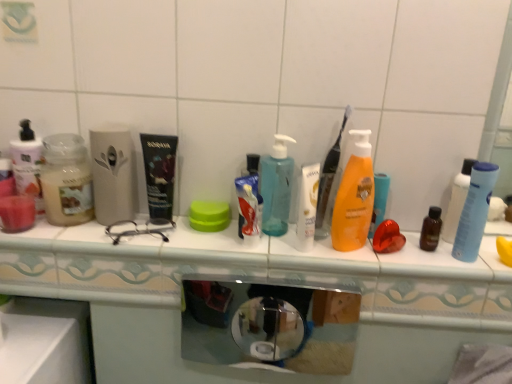
Question: Choose the correct answer: Is white glossy toothpaste at center inside translucent plastic pump bottle at center, the 2th bottle viewed from the left, or outside it?

Choices:
 (A) inside
 (B) outside

Answer: (B)

Question: Is white glossy toothpaste at center wider or thinner than translucent plastic pump bottle at center, the 2th bottle viewed from the left?

Choices:
 (A) thin
 (B) wide

Answer: (A)

Question: Which of these objects is positioned closest to the translucent plastic pump bottle at center, the 2th bottle viewed from the left?

Choices:
 (A) white glossy lotion at center
 (B) green plastic lid at center
 (C) blue matte bottle at right
 (D) white glossy toothpaste at center
 (E) orange matte lotion at center, the 1th bottle when ordered from right to left

Answer: (D)

Question: Which object is the farthest from the green plastic lid at center?

Choices:
 (A) orange matte lotion at center, the 1th bottle when ordered from right to left
 (B) white glossy toothpaste at center
 (C) matte glass jar at left, the first bottle positioned from the left
 (D) translucent plastic pump bottle at center, the 2th bottle viewed from the left
 (E) white glossy lotion at center

Answer: (A)